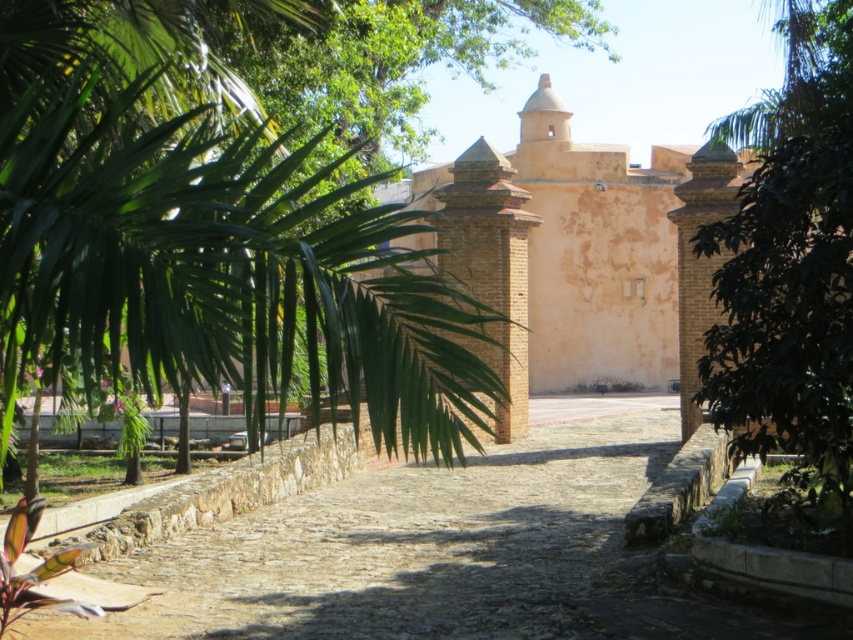
In the scene shown: You are standing at the entrance of the historic site and want to take a photo that includes both the green leafy tree at center and the light brown brick church at center. Which object should you position closer to the foreground to ensure both are fully visible in the frame?

You should position the green leafy tree at center closer to the foreground because it is shorter than the light brown brick church at center, allowing both to be fully visible in the frame.

You are standing at the entrance of the historic fortification and see two points marked on the cobblestone pathway. The first point is at coordinates point [846,112] and the second at point [408,243]. Which point is nearer to you as you face the pathway leading towards the wall?

Point [846,112] is closer to the viewer than point [408,243].